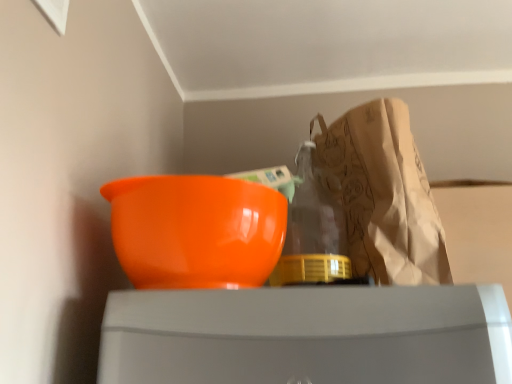
Question: Would you say brown paper grocery bag at upper right is to the left or to the right of glossy plastic bowl at left in the picture?

Choices:
 (A) left
 (B) right

Answer: (B)

Question: From the image's perspective, is brown paper grocery bag at upper right positioned above or below glossy plastic bowl at left?

Choices:
 (A) below
 (B) above

Answer: (B)

Question: Considering the positions of point (403, 221) and point (256, 278), is point (403, 221) closer or farther from the camera than point (256, 278)?

Choices:
 (A) farther
 (B) closer

Answer: (A)

Question: From the image's perspective, is glossy plastic bowl at left positioned above or below brown paper grocery bag at upper right?

Choices:
 (A) above
 (B) below

Answer: (B)

Question: Is glossy plastic bowl at left bigger or smaller than brown paper grocery bag at upper right?

Choices:
 (A) big
 (B) small

Answer: (B)

Question: Choose the correct answer: Is glossy plastic bowl at left inside brown paper grocery bag at upper right or outside it?

Choices:
 (A) outside
 (B) inside

Answer: (A)

Question: From a real-world perspective, relative to brown paper grocery bag at upper right, is glossy plastic bowl at left vertically above or below?

Choices:
 (A) above
 (B) below

Answer: (B)